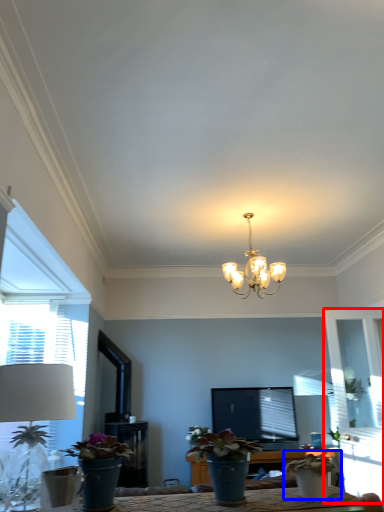
Question: Among these objects, which one is farthest to the camera, glass door (highlighted by a red box) or houseplant (highlighted by a blue box)?

Choices:
 (A) glass door
 (B) houseplant

Answer: (A)